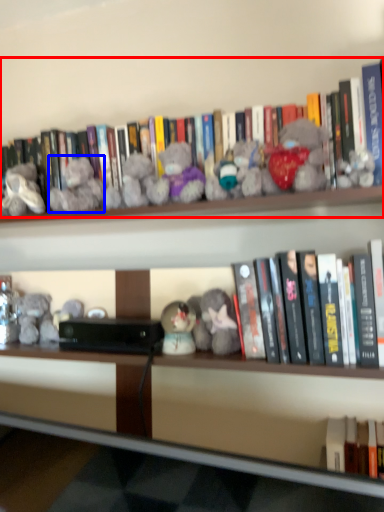
Question: Which object appears farthest to the camera in this image, book (highlighted by a red box) or toy (highlighted by a blue box)?

Choices:
 (A) book
 (B) toy

Answer: (B)